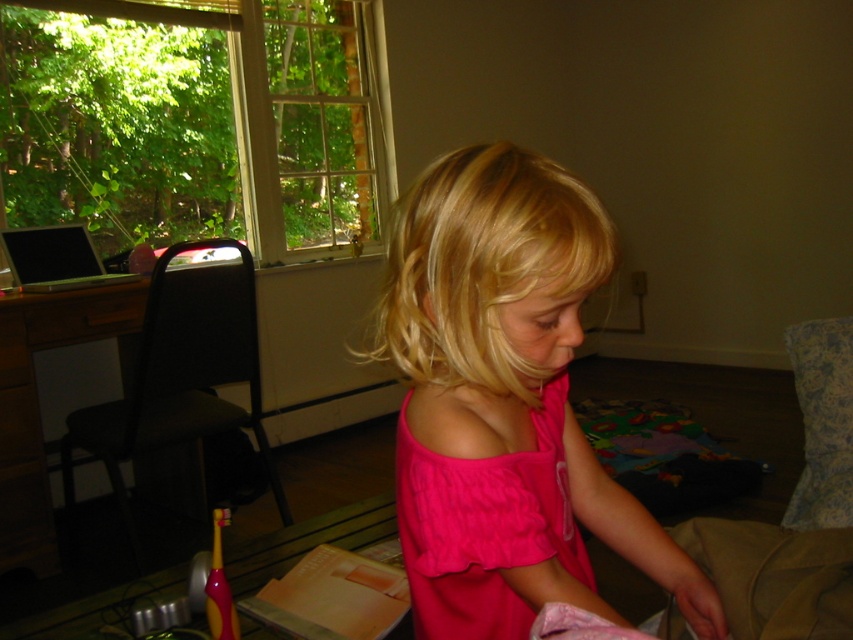
You are helping a child get dressed and see the pink cotton shirt at center and the cotton pink dress at center. Which clothing item is on top?

The pink cotton shirt at center is positioned over the cotton pink dress at center, so the shirt is on top.

You are organizing a closet and need to hang the pink cotton shirt at center and the cotton pink dress at center. Since both are at the center, which one is closer to the hanger?

The pink cotton shirt at center is in front of the cotton pink dress at center, so it is closer to the hanger.

You are taking a photo of the scene and want to focus on both point (532, 296) and point (413, 612). Which point should you adjust your focus to first to ensure both are in clear view?

Point (532, 296) is closer to the camera than point (413, 612). To ensure both are in focus, you should adjust your focus starting with the closer point, point (532, 296).